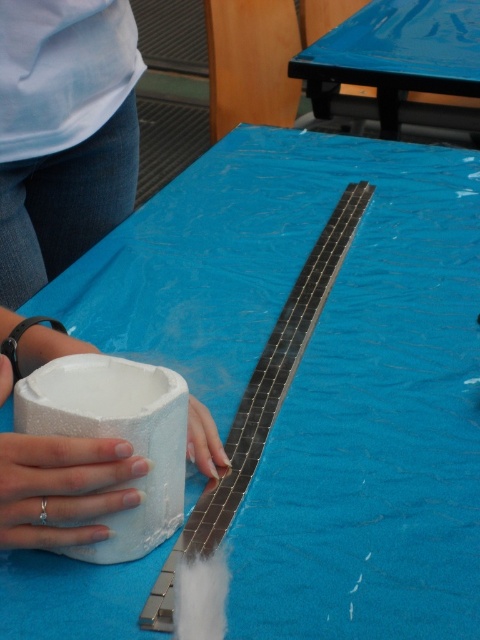
Does white foam paper towel at lower left appear under white matte foam at lower left?

Yes, white foam paper towel at lower left is below white matte foam at lower left.

Is white foam paper towel at lower left above white matte foam at lower left?

Incorrect, white foam paper towel at lower left is not positioned above white matte foam at lower left.

You are a GUI agent. You are given a task and a screenshot of the screen. Output one action in this format:
    pyautogui.click(x=<x>, y=<y>)
    Task: Click on the white foam paper towel at lower left
    This screenshot has height=640, width=480.
    Given the screenshot: What is the action you would take?
    pyautogui.click(x=116, y=436)

From the picture: Which is above, blue glossy table at upper center or silver metallic ring at lower left?

Positioned higher is blue glossy table at upper center.

Who is more distant from viewer, (477, 33) or (58, 506)?

The point (477, 33) is behind.

Does point (323, 42) come farther from viewer compared to point (63, 531)?

Yes.

At what (x,y) coordinates should I click in order to perform the action: click on blue glossy table at upper center. Please return your answer as a coordinate pair (x, y). Looking at the image, I should click on (395, 54).

Is white matte shirt at upper left shorter than white matte foam at lower left?

No, white matte shirt at upper left is not shorter than white matte foam at lower left.

Between white matte shirt at upper left and white matte foam at lower left, which one appears on the left side from the viewer's perspective?

Positioned to the left is white matte shirt at upper left.

Between point (19, 65) and point (0, 376), which one is positioned behind?

The point (19, 65) is behind.

Where is `white matte shirt at upper left`? Image resolution: width=480 pixels, height=640 pixels. white matte shirt at upper left is located at coordinates (62, 132).